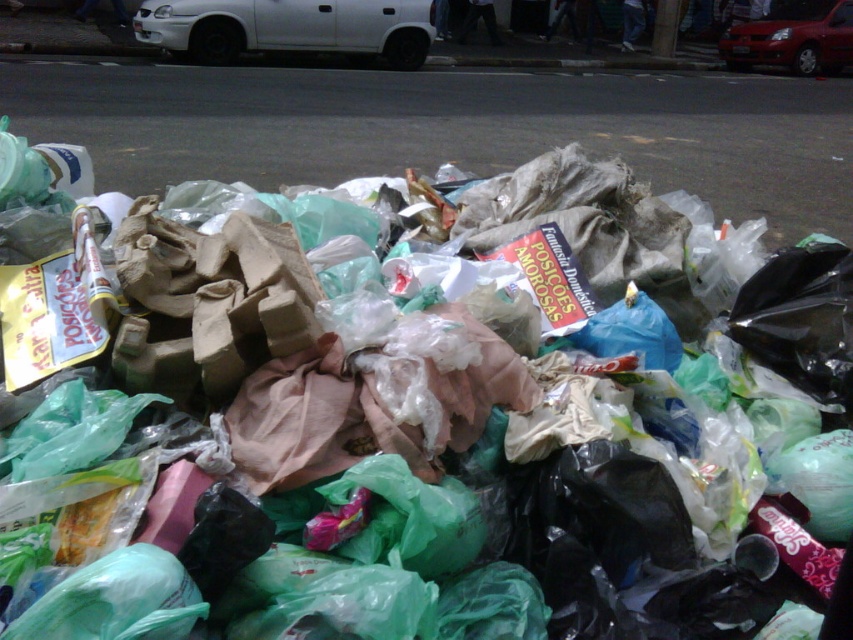
Question: Among these points, which one is nearest to the camera?

Choices:
 (A) (750, 44)
 (B) (183, 0)

Answer: (B)

Question: Does white matte car at upper left lie in front of shiny red car at upper right?

Choices:
 (A) yes
 (B) no

Answer: (A)

Question: Is white matte car at upper left below shiny red car at upper right?

Choices:
 (A) no
 (B) yes

Answer: (B)

Question: Among these objects, which one is farthest from the camera?

Choices:
 (A) white matte car at upper left
 (B) shiny red car at upper right

Answer: (B)

Question: Can you confirm if white matte car at upper left is thinner than shiny red car at upper right?

Choices:
 (A) yes
 (B) no

Answer: (B)